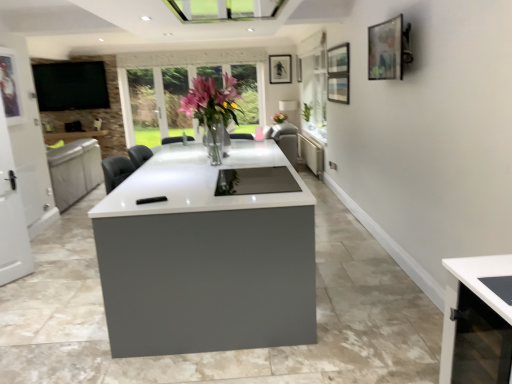
Question: Is point pyautogui.click(x=15, y=94) closer or farther from the camera than point pyautogui.click(x=307, y=160)?

Choices:
 (A) farther
 (B) closer

Answer: (B)

Question: From the image's perspective, is metallic silver picture frame at left, which is the 3th picture frame from back to front, above or below matte gray radiator at center?

Choices:
 (A) below
 (B) above

Answer: (B)

Question: Estimate the real-world distances between objects in this image. Which object is farther from the matte black picture frame at upper center, the 2th picture frame viewed from the left?

Choices:
 (A) translucent glass vase at center
 (B) green leafy plant at center
 (C) matte black picture frame at upper right, which is the 1th picture frame from right to left
 (D) matte black picture frame at upper center, positioned as the third picture frame in bottom-to-top order
 (E) metallic silver picture frame at left, marked as the 1th picture frame in a left-to-right arrangement

Answer: (E)

Question: Which object is positioned closest to the metallic silver picture frame at left, the 4th picture frame viewed from the right?

Choices:
 (A) white glossy door at left
 (B) matte black picture frame at upper center, positioned as the third picture frame in bottom-to-top order
 (C) matte black picture frame at upper center, which ranks as the fourth picture frame in bottom-to-top order
 (D) green leafy plant at center
 (E) translucent glass vase at center

Answer: (A)